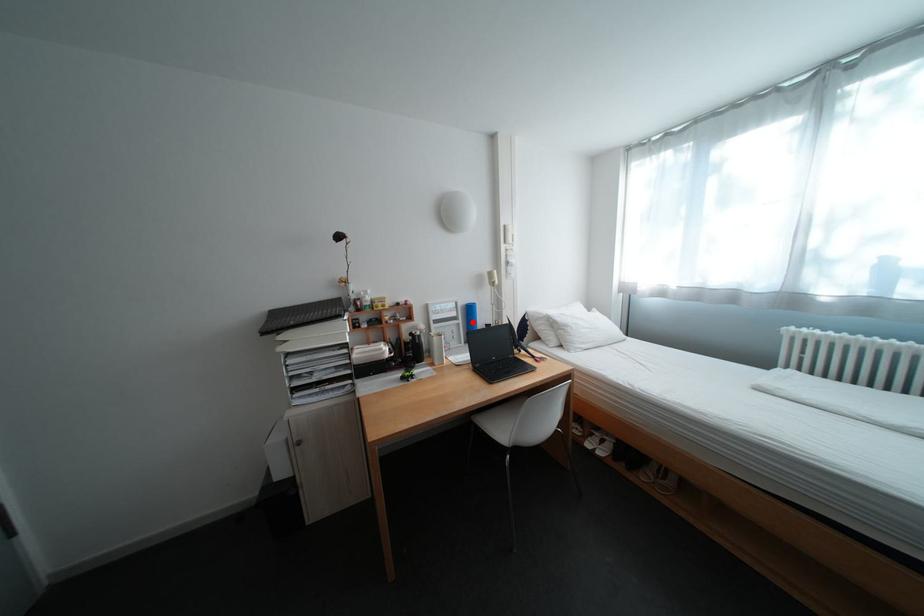
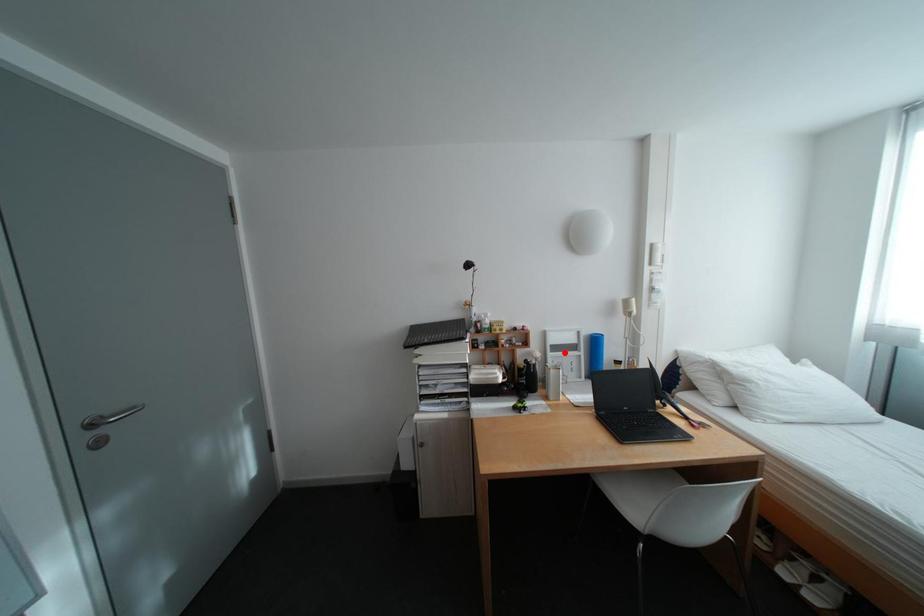
From the picture: I am providing you with two images of the same scene from different viewpoints. A red point is marked on the first image and another point is marked on the second image. Is the red point in image1 aligned with the point shown in image2?

No